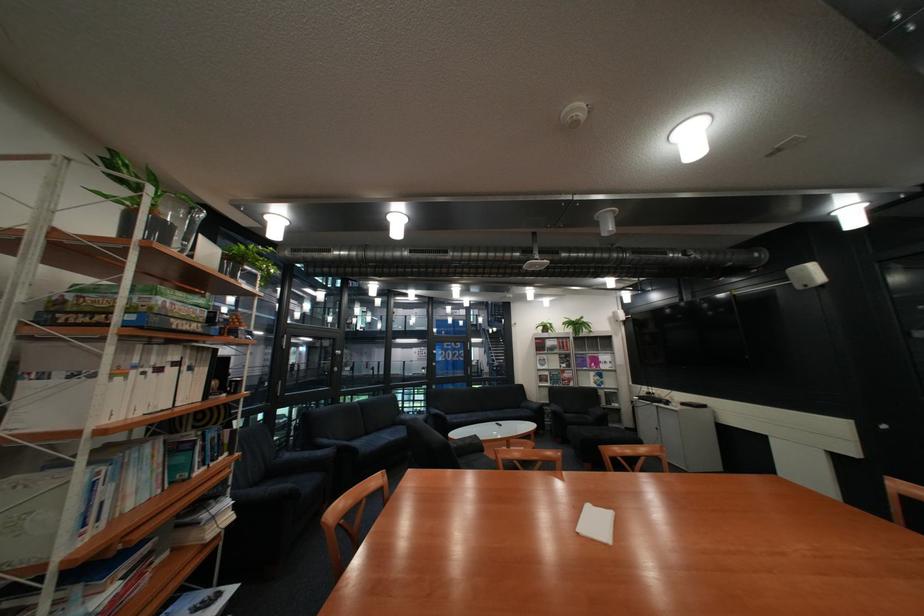
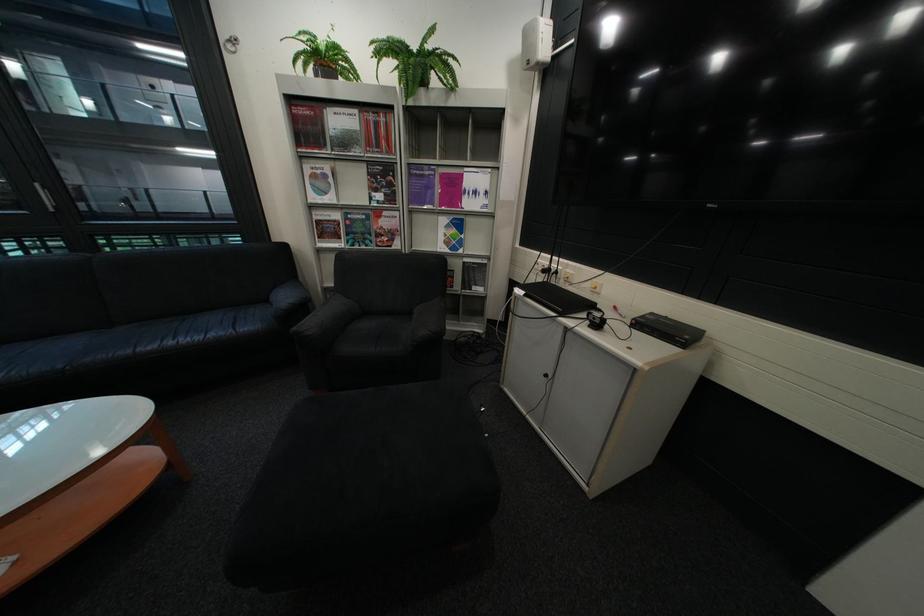
Where in the second image is the point corresponding to point (558, 331) from the first image?

(333, 78)